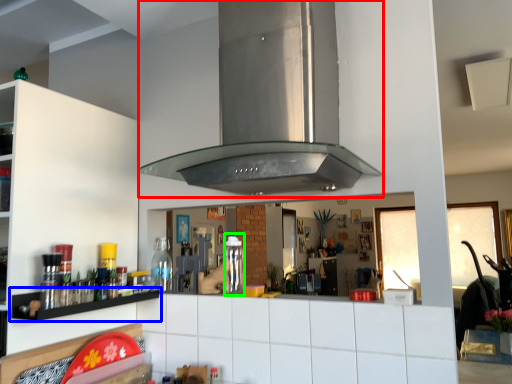
Question: Which object is the closest to the vent (highlighted by a red box)? Choose among these: shelf (highlighted by a blue box) or bottle (highlighted by a green box).

Choices:
 (A) shelf
 (B) bottle

Answer: (B)